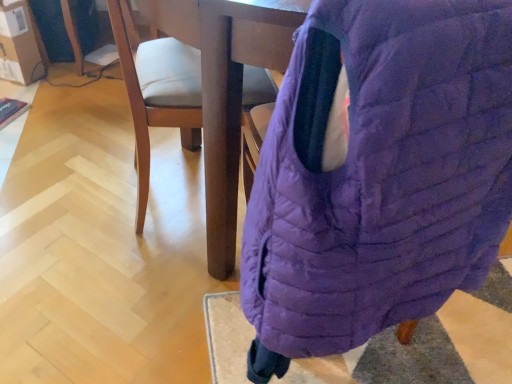
Question: Is light brown wood chair at center taller than matte brown cardboard at upper left?

Choices:
 (A) yes
 (B) no

Answer: (A)

Question: Can you confirm if light brown wood chair at center is shorter than matte brown cardboard at upper left?

Choices:
 (A) no
 (B) yes

Answer: (A)

Question: Would you say light brown wood chair at center contains matte brown cardboard at upper left?

Choices:
 (A) yes
 (B) no

Answer: (B)

Question: Is light brown wood chair at center in contact with matte brown cardboard at upper left?

Choices:
 (A) yes
 (B) no

Answer: (B)

Question: From a real-world perspective, is light brown wood chair at center physically below matte brown cardboard at upper left?

Choices:
 (A) no
 (B) yes

Answer: (A)

Question: Would you say light brown wood chair at center is a long distance from matte brown cardboard at upper left?

Choices:
 (A) yes
 (B) no

Answer: (A)

Question: From a real-world perspective, is matte brown cardboard at upper left located beneath purple quilted bean bag chair at center?

Choices:
 (A) no
 (B) yes

Answer: (B)

Question: From the image's perspective, is matte brown cardboard at upper left on top of purple quilted bean bag chair at center?

Choices:
 (A) yes
 (B) no

Answer: (A)

Question: Is matte brown cardboard at upper left in front of purple quilted bean bag chair at center?

Choices:
 (A) yes
 (B) no

Answer: (B)

Question: Is matte brown cardboard at upper left completely or partially outside of purple quilted bean bag chair at center?

Choices:
 (A) yes
 (B) no

Answer: (A)

Question: Can purple quilted bean bag chair at center be found inside matte brown cardboard at upper left?

Choices:
 (A) yes
 (B) no

Answer: (B)

Question: Can you confirm if matte brown cardboard at upper left is positioned to the right of purple quilted bean bag chair at center?

Choices:
 (A) no
 (B) yes

Answer: (A)

Question: Does purple quilted bean bag chair at center have a larger size compared to matte brown cardboard at upper left?

Choices:
 (A) yes
 (B) no

Answer: (A)